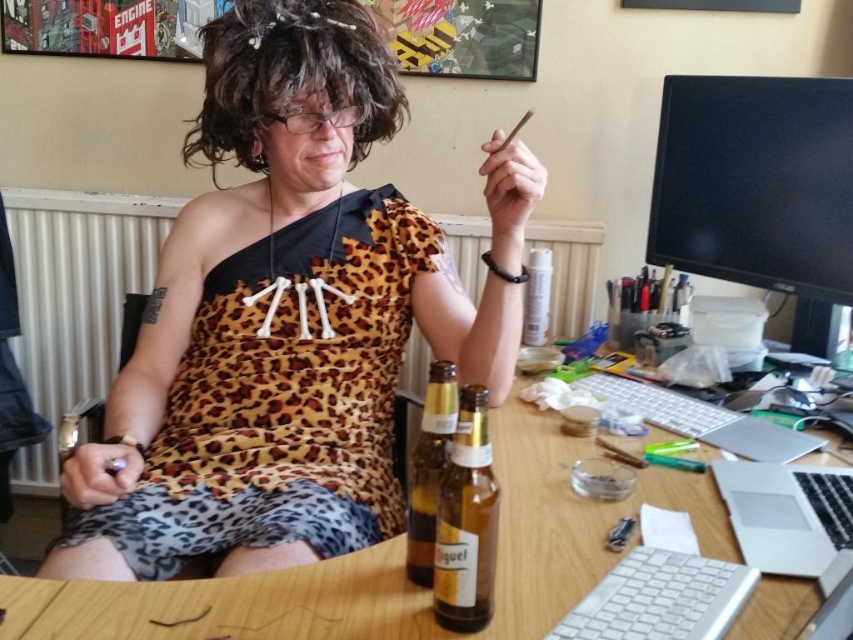
In the scene shown: Between curly brown hair at upper center and translucent glass bottle at center, which one appears on the left side from the viewer's perspective?

curly brown hair at upper center is more to the left.

Is point (228, 145) positioned in front of point (444, 385)?

No, (228, 145) is behind (444, 385).

Which is behind, point (236, 131) or point (444, 449)?

The point (236, 131) is behind.

Identify the location of curly brown hair at upper center. This screenshot has width=853, height=640. (291, 76).

The width and height of the screenshot is (853, 640). I want to click on leopard print dress at center, so click(286, 317).

Which is more to the left, leopard print dress at center or translucent glass bottle at center?

leopard print dress at center is more to the left.

Locate an element on the screen. The height and width of the screenshot is (640, 853). leopard print dress at center is located at coordinates (286, 317).

Where is `leopard print dress at center`? The height and width of the screenshot is (640, 853). leopard print dress at center is located at coordinates (286, 317).

Does brown glass bottle at center appear on the left side of silver metallic laptop at right?

Yes, brown glass bottle at center is to the left of silver metallic laptop at right.

Who is more distant from viewer, [483,572] or [694,417]?

Positioned behind is point [694,417].

Does point (459, 529) come behind point (647, 385)?

No, it is in front of (647, 385).

At what (x,y) coordinates should I click in order to perform the action: click on brown glass bottle at center. Please return your answer as a coordinate pair (x, y). The image size is (853, 640). Looking at the image, I should click on (466, 522).